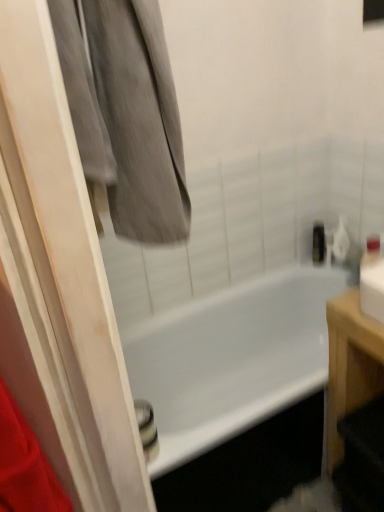
Where is `vacant space that is to the left of metallic silver toiletry at upper right`? This screenshot has height=512, width=384. vacant space that is to the left of metallic silver toiletry at upper right is located at coordinates (302, 269).